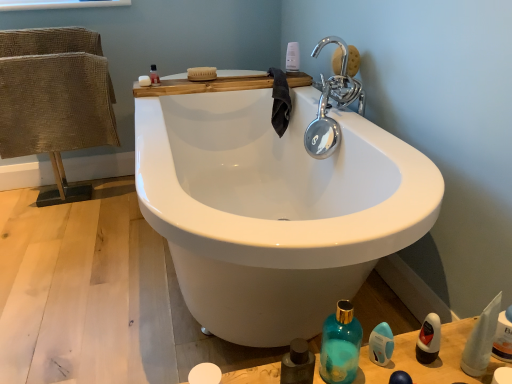
This screenshot has width=512, height=384. What do you see at coordinates (429, 364) in the screenshot?
I see `translucent glass bottles at lower right` at bounding box center [429, 364].

I want to click on translucent glass bottles at lower right, so click(x=429, y=364).

Where is `white plastic bottle at upper center, marked as the third toiletry in a front-to-back arrangement`? white plastic bottle at upper center, marked as the third toiletry in a front-to-back arrangement is located at coordinates (292, 57).

Image resolution: width=512 pixels, height=384 pixels. What do you see at coordinates (481, 340) in the screenshot?
I see `white fabric towel at lower right, placed as the second toiletry when sorted from back to front` at bounding box center [481, 340].

Locate an element on the screen. teal glass bottle at lower right is located at coordinates (340, 345).

Does black plastic bottle at lower right, the 2th mouthwash ordered from the bottom, have a lesser width compared to translucent glass bottles at lower right?

Indeed, black plastic bottle at lower right, the 2th mouthwash ordered from the bottom, has a lesser width compared to translucent glass bottles at lower right.

Is black plastic bottle at lower right, marked as the 1th mouthwash in a front-to-back arrangement, with translucent glass bottles at lower right?

No, black plastic bottle at lower right, marked as the 1th mouthwash in a front-to-back arrangement, is not beside translucent glass bottles at lower right.

Between black plastic bottle at lower right, which is the second mouthwash from top to bottom, and translucent glass bottles at lower right, which one has larger size?

translucent glass bottles at lower right is bigger.

Is black plastic bottle at lower right, arranged as the 3th mouthwash when viewed from the left, surrounding translucent glass bottles at lower right?

No, black plastic bottle at lower right, arranged as the 3th mouthwash when viewed from the left, does not contain translucent glass bottles at lower right.

From a real-world perspective, is translucent plastic mouthwash at upper left, acting as the 3th mouthwash starting from the bottom, on teal glass bottle at lower right?

Yes.

Based on the photo, which is correct: translucent plastic mouthwash at upper left, positioned as the 1th mouthwash in back-to-front order, is inside teal glass bottle at lower right, or outside of it?

translucent plastic mouthwash at upper left, positioned as the 1th mouthwash in back-to-front order, is not inside teal glass bottle at lower right, it's outside.

Is translucent plastic mouthwash at upper left, which is the 3th mouthwash in front-to-back order, shorter than teal glass bottle at lower right?

Indeed, translucent plastic mouthwash at upper left, which is the 3th mouthwash in front-to-back order, has a lesser height compared to teal glass bottle at lower right.

Could you measure the distance between translucent plastic mouthwash at upper left, positioned as the 1th mouthwash in back-to-front order, and teal glass bottle at lower right?

translucent plastic mouthwash at upper left, positioned as the 1th mouthwash in back-to-front order, and teal glass bottle at lower right are 1.37 meters apart from each other.

From the image's perspective, which is above, matte black bottle at lower center, the third toiletry when ordered from back to front, or teal glass bottle at lower right?

From the image's view, teal glass bottle at lower right is above.

Considering the positions of objects matte black bottle at lower center, acting as the 1th toiletry starting from the front, and teal glass bottle at lower right in the image provided, who is in front, matte black bottle at lower center, acting as the 1th toiletry starting from the front, or teal glass bottle at lower right?

matte black bottle at lower center, acting as the 1th toiletry starting from the front.

Considering the relative sizes of matte black bottle at lower center, which is the 3th toiletry from right to left, and teal glass bottle at lower right in the image provided, is matte black bottle at lower center, which is the 3th toiletry from right to left, wider than teal glass bottle at lower right?

No, matte black bottle at lower center, which is the 3th toiletry from right to left, is not wider than teal glass bottle at lower right.

What's the angular difference between matte black bottle at lower center, the third toiletry when ordered from back to front, and teal glass bottle at lower right's facing directions?

The facing directions of matte black bottle at lower center, the third toiletry when ordered from back to front, and teal glass bottle at lower right are 89.9 degrees apart.

From a real-world perspective, is white fabric towel at lower right, the 2th toiletry viewed from the front, physically above white plastic bottle at upper center, the second toiletry in the right-to-left sequence?

No, from a real-world perspective, white fabric towel at lower right, the 2th toiletry viewed from the front, is not over white plastic bottle at upper center, the second toiletry in the right-to-left sequence

Would you say white fabric towel at lower right, arranged as the 1th toiletry when viewed from the right, contains white plastic bottle at upper center, placed as the first toiletry when sorted from top to bottom?

No, white plastic bottle at upper center, placed as the first toiletry when sorted from top to bottom, is not inside white fabric towel at lower right, arranged as the 1th toiletry when viewed from the right.

Measure the distance from white plastic bottle at upper center, placed as the first toiletry when sorted from top to bottom, to burlap fabric chair at left.

The distance of white plastic bottle at upper center, placed as the first toiletry when sorted from top to bottom, from burlap fabric chair at left is 3.79 feet.

From a real-world perspective, is white plastic bottle at upper center, the second toiletry in the right-to-left sequence, physically above burlap fabric chair at left?

Indeed, from a real-world perspective, white plastic bottle at upper center, the second toiletry in the right-to-left sequence, stands above burlap fabric chair at left.

In the image, is white plastic bottle at upper center, placed as the 3th toiletry when sorted from bottom to top, positioned in front of or behind burlap fabric chair at left?

white plastic bottle at upper center, placed as the 3th toiletry when sorted from bottom to top, is positioned farther from the viewer than burlap fabric chair at left.

Is burlap fabric chair at left located within white plastic bottle at upper center, which is the 1th toiletry from back to front?

No, burlap fabric chair at left is not a part of white plastic bottle at upper center, which is the 1th toiletry from back to front.

Is matte black bottle at lower center, which is counted as the third toiletry, starting from the top, oriented away from black plastic bottle at lower right, the 2th mouthwash ordered from the bottom?

matte black bottle at lower center, which is counted as the third toiletry, starting from the top, does not have its back to black plastic bottle at lower right, the 2th mouthwash ordered from the bottom.

Considering the relative positions of matte black bottle at lower center, acting as the 1th toiletry starting from the front, and black plastic bottle at lower right, marked as the 1th mouthwash in a front-to-back arrangement, in the image provided, is matte black bottle at lower center, acting as the 1th toiletry starting from the front, behind black plastic bottle at lower right, marked as the 1th mouthwash in a front-to-back arrangement,?

No, matte black bottle at lower center, acting as the 1th toiletry starting from the front, is in front of black plastic bottle at lower right, marked as the 1th mouthwash in a front-to-back arrangement.

Which point is more forward, (305, 361) or (428, 349)?

Positioned in front is point (305, 361).

You are a GUI agent. You are given a task and a screenshot of the screen. Output one action in this format:
    pyautogui.click(x=<x>, y=<y>)
    Task: Click on the 1st mouthwash directly beneath the matte black bottle at lower center, acting as the 1th toiletry starting from the front (from a real-world perspective)
    
    Given the screenshot: What is the action you would take?
    pyautogui.click(x=429, y=339)

Considering the positions of points (153, 81) and (471, 343), is point (153, 81) farther from camera compared to point (471, 343)?

Yes, point (153, 81) is behind point (471, 343).

From the image's perspective, which is above, translucent plastic mouthwash at upper left, which appears as the first mouthwash when viewed from the top, or white fabric towel at lower right, the 2th toiletry viewed from the front?

translucent plastic mouthwash at upper left, which appears as the first mouthwash when viewed from the top, appears higher in the image.

Could you measure the distance between translucent plastic mouthwash at upper left, arranged as the 1th mouthwash when viewed from the left, and white fabric towel at lower right, which is counted as the third toiletry, starting from the left?

translucent plastic mouthwash at upper left, arranged as the 1th mouthwash when viewed from the left, is 1.53 meters from white fabric towel at lower right, which is counted as the third toiletry, starting from the left.

Considering the relative sizes of translucent plastic mouthwash at upper left, acting as the 3th mouthwash starting from the bottom, and white fabric towel at lower right, which is counted as the third toiletry, starting from the left, in the image provided, is translucent plastic mouthwash at upper left, acting as the 3th mouthwash starting from the bottom, taller than white fabric towel at lower right, which is counted as the third toiletry, starting from the left,?

In fact, translucent plastic mouthwash at upper left, acting as the 3th mouthwash starting from the bottom, may be shorter than white fabric towel at lower right, which is counted as the third toiletry, starting from the left.

Find the location of a particular element. Image resolution: width=512 pixels, height=384 pixels. the 2nd mouthwash located above the translucent glass bottles at lower right (from a real-world perspective) is located at coordinates pyautogui.click(x=429, y=339).

You are a GUI agent. You are given a task and a screenshot of the screen. Output one action in this format:
    pyautogui.click(x=<x>, y=<y>)
    Task: Click on the mouthwash above the teal glass bottle at lower right (from the image's perspective)
    This screenshot has width=512, height=384.
    Given the screenshot: What is the action you would take?
    pyautogui.click(x=154, y=75)

When comparing their distances from white fabric towel at lower right, which is counted as the third toiletry, starting from the left, does blue glossy mouthwash at lower right, which is the second mouthwash from front to back, or teal glass bottle at lower right seem closer?

blue glossy mouthwash at lower right, which is the second mouthwash from front to back.

From the image, which object appears to be nearer to white fabric towel at lower right, the 2th toiletry viewed from the front, teal glass bottle at lower right or burlap fabric chair at left?

The object closer to white fabric towel at lower right, the 2th toiletry viewed from the front, is teal glass bottle at lower right.

Looking at the image, which one is located closer to blue glossy mouthwash at lower right, which is the second mouthwash from front to back, translucent plastic mouthwash at upper left, positioned as the 1th mouthwash in back-to-front order, or burlap fabric chair at left?

translucent plastic mouthwash at upper left, positioned as the 1th mouthwash in back-to-front order, is closer to blue glossy mouthwash at lower right, which is the second mouthwash from front to back.

Looking at the image, which one is located closer to white plastic bottle at upper center, marked as the third toiletry in a front-to-back arrangement, black plastic bottle at lower right, marked as the 1th mouthwash in a front-to-back arrangement, or white matte soap at upper center?

Among the two, white matte soap at upper center is located nearer to white plastic bottle at upper center, marked as the third toiletry in a front-to-back arrangement.

From the image, which object appears to be nearer to translucent glass bottles at lower right, translucent plastic mouthwash at upper left, acting as the 3th mouthwash starting from the bottom, or white plastic bottle at upper center, marked as the third toiletry in a front-to-back arrangement?

Based on the image, translucent plastic mouthwash at upper left, acting as the 3th mouthwash starting from the bottom, appears to be nearer to translucent glass bottles at lower right.

Considering their positions, is blue glossy mouthwash at lower right, marked as the second mouthwash in a back-to-front arrangement, positioned closer to white fabric towel at lower right, the 2th toiletry viewed from the front, than matte black bottle at lower center, acting as the 1th toiletry starting from the front?

blue glossy mouthwash at lower right, marked as the second mouthwash in a back-to-front arrangement, lies closer to white fabric towel at lower right, the 2th toiletry viewed from the front, than the other object.

Considering their positions, is teal glass bottle at lower right positioned closer to translucent plastic mouthwash at upper left, positioned as the 1th mouthwash in back-to-front order, than black plastic bottle at lower right, arranged as the 3th mouthwash when viewed from the left?

The object closer to translucent plastic mouthwash at upper left, positioned as the 1th mouthwash in back-to-front order, is teal glass bottle at lower right.

From the image, which object appears to be nearer to blue glossy mouthwash at lower right, which appears as the 2th mouthwash when viewed from the right, white plastic bottle at upper center, placed as the first toiletry when sorted from top to bottom, or white matte soap at upper center?

Based on the image, white plastic bottle at upper center, placed as the first toiletry when sorted from top to bottom, appears to be nearer to blue glossy mouthwash at lower right, which appears as the 2th mouthwash when viewed from the right.

This screenshot has height=384, width=512. In order to click on soap positioned between white fabric towel at lower right, placed as the second toiletry when sorted from back to front, and translucent plastic mouthwash at upper left, positioned as the 1th mouthwash in back-to-front order, from near to far in this screenshot , I will do `click(144, 80)`.

The image size is (512, 384). I want to click on bottle located between matte black bottle at lower center, acting as the first toiletry starting from the left, and white fabric towel at lower right, the 2th toiletry viewed from the front, in the left-right direction, so click(x=340, y=345).

Find the location of `toiletry between burlap fabric chair at left and white plastic bottle at upper center, the 2th toiletry from the left, in the horizontal direction`. toiletry between burlap fabric chair at left and white plastic bottle at upper center, the 2th toiletry from the left, in the horizontal direction is located at coordinates (297, 364).

Image resolution: width=512 pixels, height=384 pixels. Identify the location of soap between matte black bottle at lower center, the third toiletry when ordered from back to front, and translucent plastic mouthwash at upper left, arranged as the 1th mouthwash when viewed from the left, along the z-axis. [144, 80].